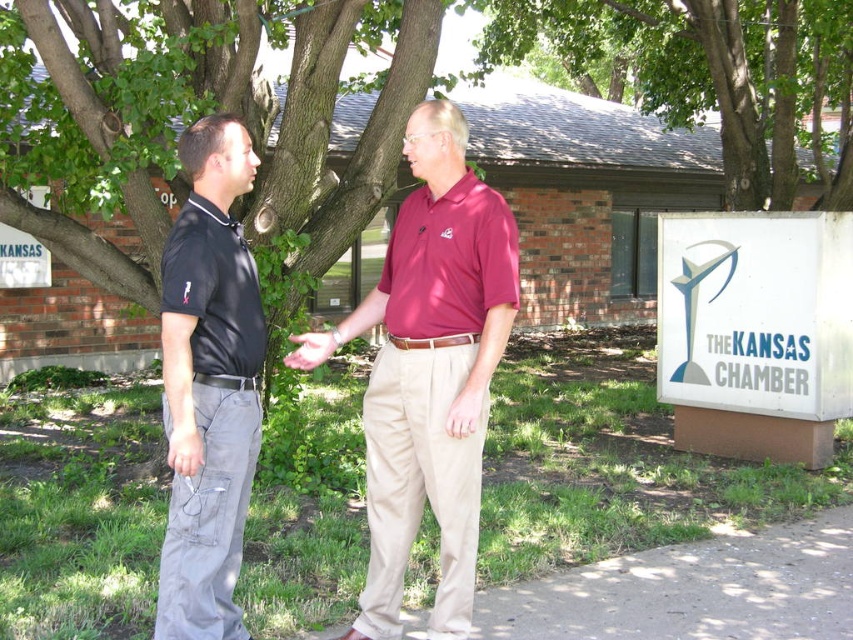
Question: Estimate the real-world distances between objects in this image. Which object is farther from the light beige leather hand at center?

Choices:
 (A) white plastic sign at right
 (B) matte gray hand at center

Answer: (A)

Question: Which point appears farthest from the camera in this image?

Choices:
 (A) (198, 445)
 (B) (209, 340)
 (C) (827, 362)

Answer: (C)

Question: Estimate the real-world distances between objects in this image. Which object is farther from the white plastic sign at right?

Choices:
 (A) light beige leather hand at center
 (B) matte black shirt at left

Answer: (B)

Question: Does white plastic sign at right lie in front of matte gray hand at center?

Choices:
 (A) no
 (B) yes

Answer: (A)

Question: Considering the relative positions of green leafy tree at upper center and light beige leather hand at center in the image provided, where is green leafy tree at upper center located with respect to light beige leather hand at center?

Choices:
 (A) right
 (B) left

Answer: (A)

Question: Is white plastic sign at right above matte gray hand at center?

Choices:
 (A) yes
 (B) no

Answer: (A)